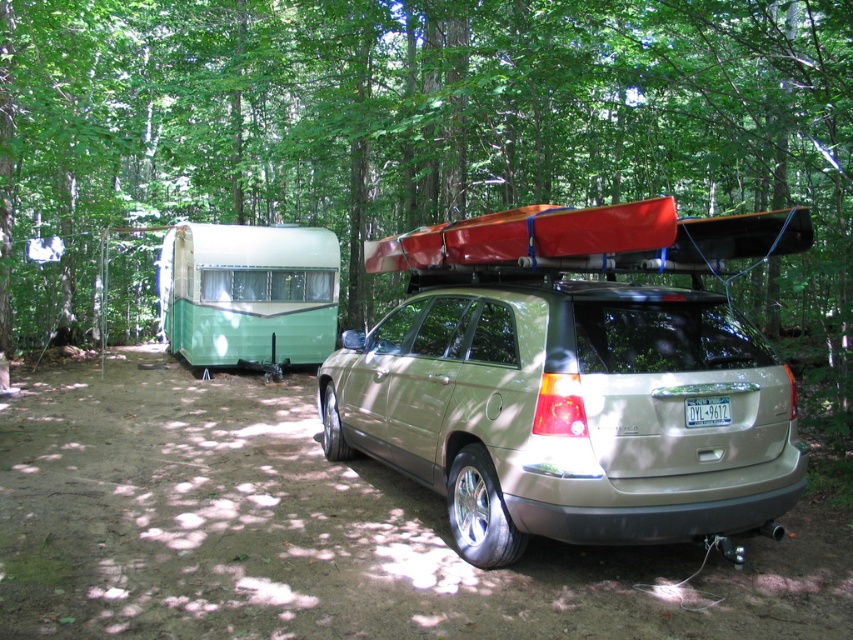
You are a photographer planning to take a photo of the green leafy tree at upper center and the satin gold suv at center. Which object should you focus on first to ensure both are in sharp focus?

You should focus on the satin gold suv at center first because it is closer to you than the green leafy tree at upper center. By focusing on the closer object, the farther one may still be in focus depending on the depth of field.

You are planning to take a photo of the green leafy tree at upper center and the satin gold suv at center from the front of the image. Which object will appear larger in the photo?

The green leafy tree at upper center will appear larger in the photo because it is much taller than the satin gold suv at center.